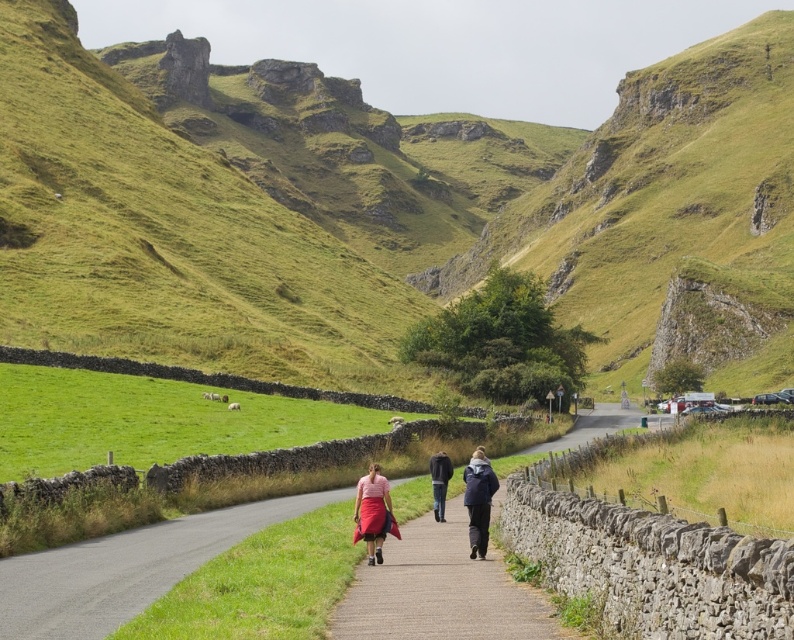
You are a photographer standing on the pathway and want to capture a photo of the matte pink skirt at center and the dark blue jacket at center. Which object should you focus on first if you want to ensure both are in sharp focus?

The matte pink skirt at center is above the dark blue jacket at center, so you should focus on the matte pink skirt at center first to ensure both are in sharp focus.

You are a photographer standing at the start of the pathway in the rural scene. You see the matte pink skirt at center and the dark blue jacket at center. Which piece of clothing should you adjust your camera to focus on first if you want to capture both in a single frame without moving? Explain your reasoning based on their positions.

The matte pink skirt at center is to the left of the dark blue jacket at center. Since the skirt is positioned to the left, you should focus on the matte pink skirt at center first to ensure it is in the frame before adjusting to include the dark blue jacket at center on the right.

You are a photographer carrying a 1.2 meter wide camera setup. You want to walk along the paved stone path at center while avoiding the pink fabric skirt at center. Is the path wide enough for your equipment?

The paved stone path at center might be wider than the pink fabric skirt at center, but since the exact width isn t specified, it s uncertain whether the path can accommodate the 1.2 meter wide camera setup. You should check the path s width before proceeding.